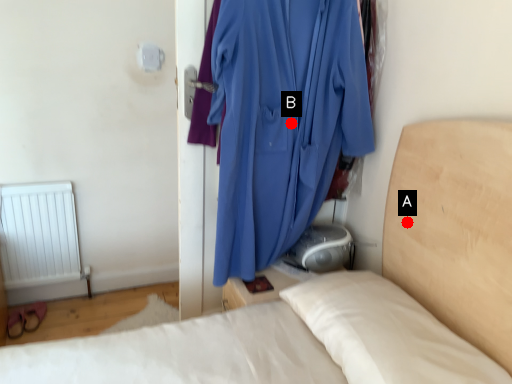
Question: Two points are circled on the image, labeled by A and B beside each circle. Which point is further to the camera?

Choices:
 (A) A is further
 (B) B is further

Answer: (B)